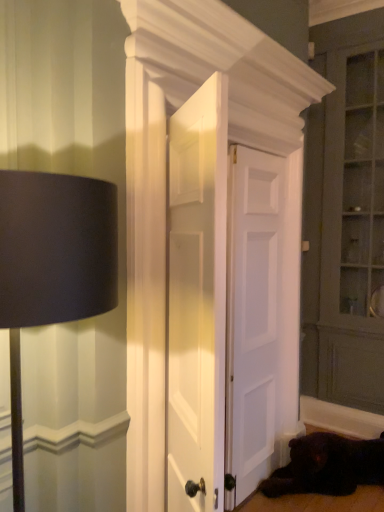
Question: Is matte gray dresser at right directly adjacent to black matte lampshade at left?

Choices:
 (A) no
 (B) yes

Answer: (A)

Question: Is black matte lampshade at left surrounded by matte gray dresser at right?

Choices:
 (A) no
 (B) yes

Answer: (A)

Question: Would you say matte gray dresser at right is outside black matte lampshade at left?

Choices:
 (A) no
 (B) yes

Answer: (B)

Question: Is matte gray dresser at right smaller than black matte lampshade at left?

Choices:
 (A) yes
 (B) no

Answer: (B)

Question: Considering the relative sizes of matte gray dresser at right and black matte lampshade at left in the image provided, is matte gray dresser at right taller than black matte lampshade at left?

Choices:
 (A) yes
 (B) no

Answer: (A)

Question: Does matte gray dresser at right appear on the left side of black matte lampshade at left?

Choices:
 (A) yes
 (B) no

Answer: (B)

Question: Is white matte door at center, which is the first door from back to front, taller than matte gray dresser at right?

Choices:
 (A) yes
 (B) no

Answer: (B)

Question: Is white matte door at center, the 3th door in the front-to-back sequence, further to the viewer compared to matte gray dresser at right?

Choices:
 (A) no
 (B) yes

Answer: (A)

Question: Is white matte door at center, which is the first door from back to front, positioned beyond the bounds of matte gray dresser at right?

Choices:
 (A) no
 (B) yes

Answer: (B)

Question: From the image's perspective, does white matte door at center, the 3th door in the front-to-back sequence, appear higher than matte gray dresser at right?

Choices:
 (A) yes
 (B) no

Answer: (B)

Question: From the image's perspective, is white matte door at center, the 3th door in the front-to-back sequence, located beneath matte gray dresser at right?

Choices:
 (A) no
 (B) yes

Answer: (B)

Question: Can matte gray dresser at right be found inside white matte door at center, which is the first door from back to front?

Choices:
 (A) no
 (B) yes

Answer: (A)

Question: Is black matte lampshade at left not close to shiny black fur at lower right?

Choices:
 (A) no
 (B) yes

Answer: (B)